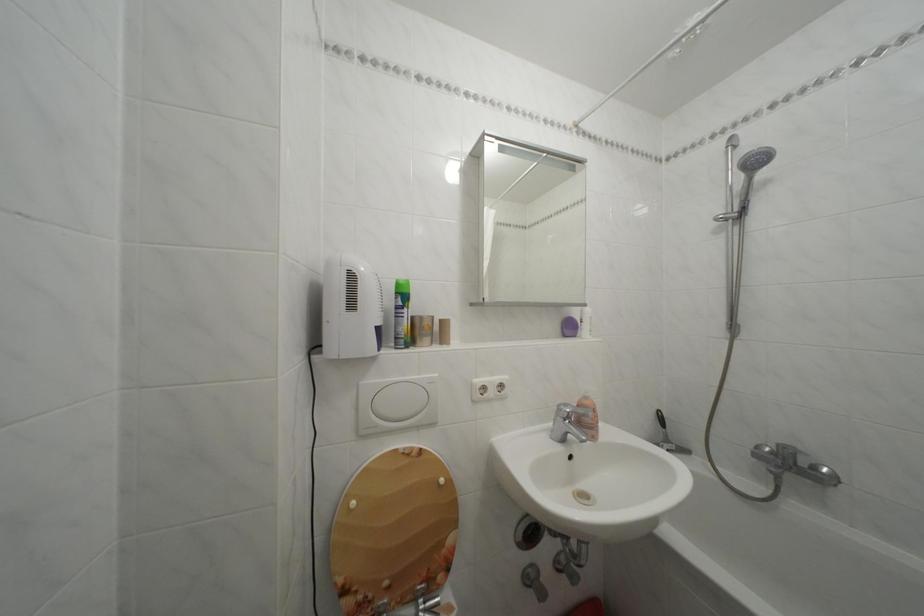
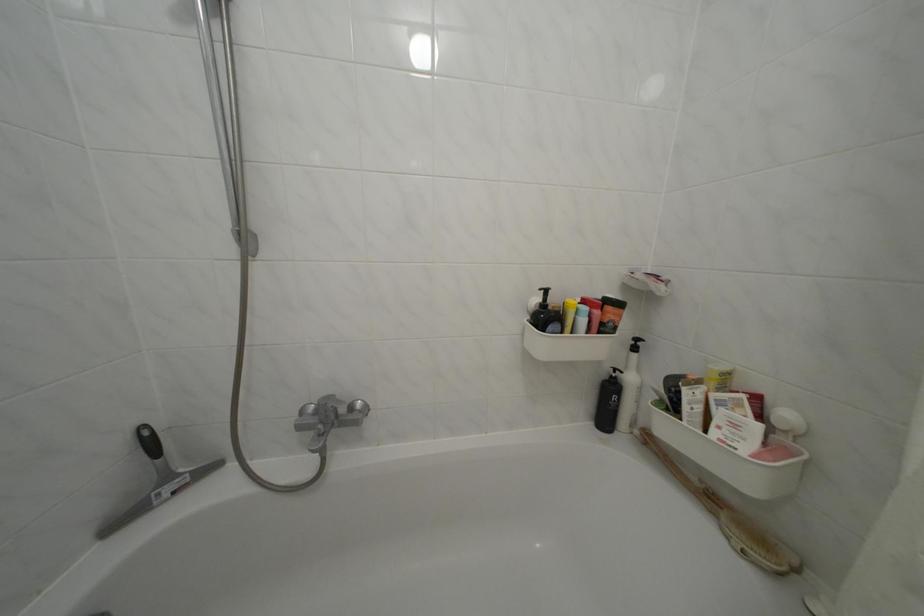
Where in the second image is the point corresponding to point (822, 475) from the first image?

(359, 414)